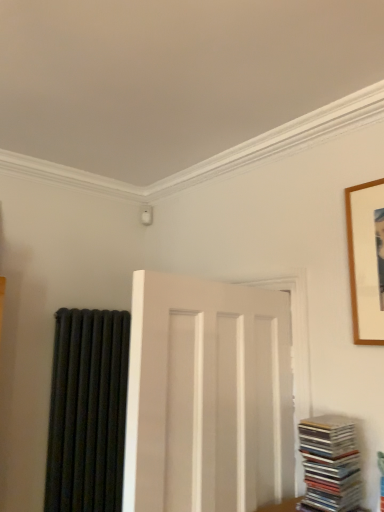
Question: From the image's perspective, is stacked glossy cds at lower right under white matte door at center?

Choices:
 (A) no
 (B) yes

Answer: (B)

Question: Is the position of stacked glossy cds at lower right more distant than that of white matte door at center?

Choices:
 (A) yes
 (B) no

Answer: (A)

Question: Is the surface of stacked glossy cds at lower right in direct contact with white matte door at center?

Choices:
 (A) yes
 (B) no

Answer: (B)

Question: Does stacked glossy cds at lower right have a greater width compared to white matte door at center?

Choices:
 (A) no
 (B) yes

Answer: (B)

Question: Can you confirm if stacked glossy cds at lower right is bigger than white matte door at center?

Choices:
 (A) no
 (B) yes

Answer: (A)

Question: Considering the positions of point (145, 308) and point (334, 439), is point (145, 308) closer or farther from the camera than point (334, 439)?

Choices:
 (A) farther
 (B) closer

Answer: (B)

Question: Is white matte door at center inside the boundaries of stacked glossy cds at lower right, or outside?

Choices:
 (A) outside
 (B) inside

Answer: (A)

Question: From a real-world perspective, is white matte door at center physically located above or below stacked glossy cds at lower right?

Choices:
 (A) above
 (B) below

Answer: (A)

Question: Considering the positions of white matte door at center and stacked glossy cds at lower right in the image, is white matte door at center taller or shorter than stacked glossy cds at lower right?

Choices:
 (A) short
 (B) tall

Answer: (B)

Question: Considering the positions of point pos(87,451) and point pos(360,498), is point pos(87,451) closer or farther from the camera than point pos(360,498)?

Choices:
 (A) closer
 (B) farther

Answer: (B)

Question: From a real-world perspective, is black matte radiator at left positioned above or below stacked glossy cds at lower right?

Choices:
 (A) below
 (B) above

Answer: (B)

Question: From the image's perspective, is black matte radiator at left located above or below stacked glossy cds at lower right?

Choices:
 (A) above
 (B) below

Answer: (B)

Question: Is black matte radiator at left in front of or behind stacked glossy cds at lower right in the image?

Choices:
 (A) front
 (B) behind

Answer: (B)

Question: From a real-world perspective, is wooden picture frame at upper right above or below black matte radiator at left?

Choices:
 (A) below
 (B) above

Answer: (B)

Question: Is wooden picture frame at upper right taller or shorter than black matte radiator at left?

Choices:
 (A) tall
 (B) short

Answer: (B)